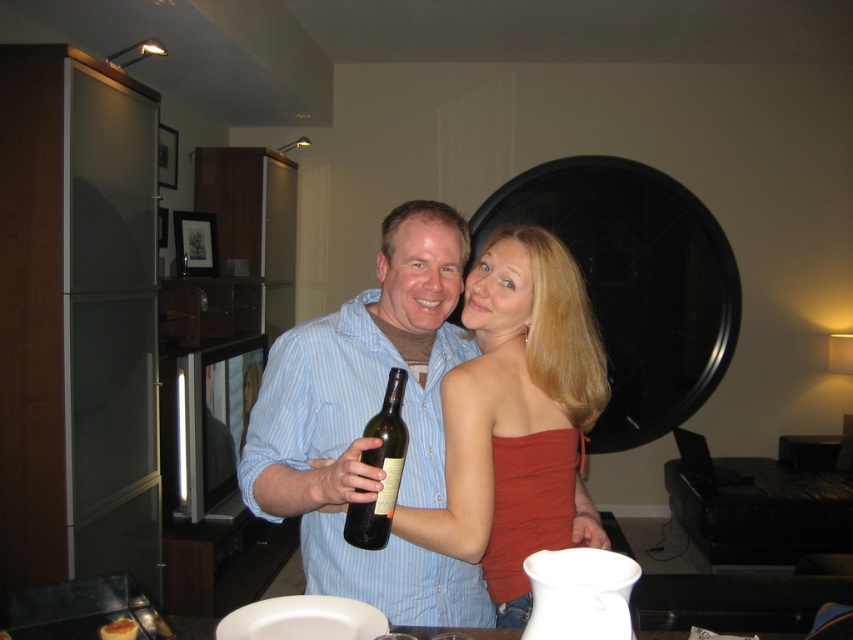
From the picture: Can you confirm if matte red strapless top at center is taller than green glass bottle at center?

Indeed, matte red strapless top at center has a greater height compared to green glass bottle at center.

Does matte red strapless top at center appear over green glass bottle at center?

Result: Yes.

Which is in front, point (445, 390) or point (402, 440)?

Point (402, 440)

Locate an element on the screen. The width and height of the screenshot is (853, 640). matte red strapless top at center is located at coordinates (518, 413).

Is matte blue shirt at center above matte red strapless top at center?

Indeed, matte blue shirt at center is positioned over matte red strapless top at center.

Is matte blue shirt at center below matte red strapless top at center?

No, matte blue shirt at center is not below matte red strapless top at center.

Identify the location of matte blue shirt at center. (364, 422).

Can you confirm if matte blue shirt at center is smaller than green glass bottle at center?

Actually, matte blue shirt at center might be larger than green glass bottle at center.

Which is behind, point (283, 509) or point (355, 532)?

The point (283, 509) is more distant.

The image size is (853, 640). Find the location of `matte blue shirt at center`. matte blue shirt at center is located at coordinates (364, 422).

In order to click on matte blue shirt at center in this screenshot , I will do `click(364, 422)`.